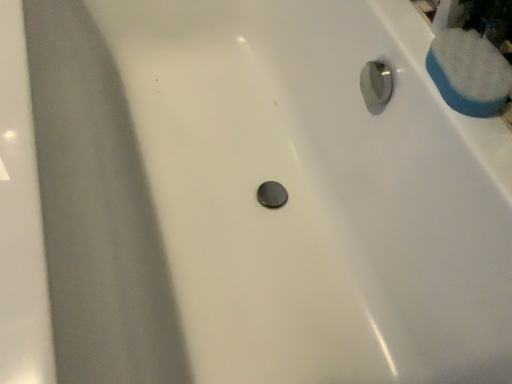
Measure the distance between point (440, 86) and camera.

The depth of point (440, 86) is 26.22 inches.

Where is `blue sponge brush at upper right`? This screenshot has height=384, width=512. blue sponge brush at upper right is located at coordinates (469, 72).

Image resolution: width=512 pixels, height=384 pixels. What do you see at coordinates (469, 72) in the screenshot?
I see `blue sponge brush at upper right` at bounding box center [469, 72].

Identify the location of blue sponge brush at upper right. This screenshot has width=512, height=384. (469, 72).